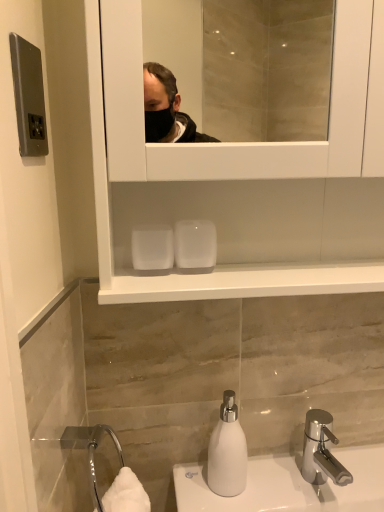
Question: Considering the positions of white matte soap dispenser at lower center and polished chrome faucet at lower right in the image, is white matte soap dispenser at lower center bigger or smaller than polished chrome faucet at lower right?

Choices:
 (A) small
 (B) big

Answer: (A)

Question: Is white matte soap dispenser at lower center to the left or to the right of polished chrome faucet at lower right in the image?

Choices:
 (A) left
 (B) right

Answer: (A)

Question: Is white matte soap dispenser at lower center situated inside polished chrome faucet at lower right or outside?

Choices:
 (A) outside
 (B) inside

Answer: (A)

Question: Based on their sizes in the image, would you say polished chrome faucet at lower right is bigger or smaller than white matte soap dispenser at lower center?

Choices:
 (A) small
 (B) big

Answer: (B)

Question: Considering the positions of point (324, 438) and point (235, 433), is point (324, 438) closer or farther from the camera than point (235, 433)?

Choices:
 (A) farther
 (B) closer

Answer: (A)

Question: Which is correct: polished chrome faucet at lower right is inside white matte soap dispenser at lower center, or outside of it?

Choices:
 (A) inside
 (B) outside

Answer: (B)

Question: Relative to white matte soap dispenser at lower center, is polished chrome faucet at lower right in front or behind?

Choices:
 (A) behind
 (B) front

Answer: (B)